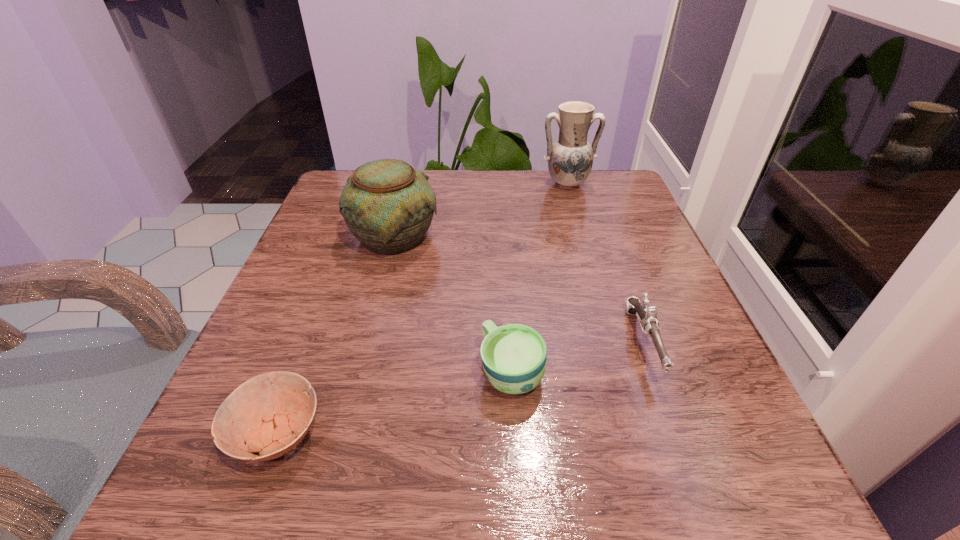
This screenshot has height=540, width=960. Identify the location of free space between the third object from left to right and the gun. (578, 357).

The width and height of the screenshot is (960, 540). Find the location of `free area in between the bowl and the third object from left to right`. free area in between the bowl and the third object from left to right is located at coordinates (395, 403).

Find the location of a particular element. The width and height of the screenshot is (960, 540). free space that is in between the bowl and the taller pottery is located at coordinates (421, 309).

Locate an element on the screen. vacant space in between the tallest object and the cup is located at coordinates (540, 278).

Locate an element on the screen. free space that is in between the fourth nearest object and the cup is located at coordinates (452, 304).

At what (x,y) coordinates should I click in order to perform the action: click on vacant space that's between the farthest object and the cup. Please return your answer as a coordinate pair (x, y). Looking at the image, I should click on (540, 278).

This screenshot has width=960, height=540. What are the coordinates of `unoccupied position between the fourth shortest object and the taller pottery` in the screenshot? It's located at (480, 210).

Where is `object that stands as the closest to the bowl`? object that stands as the closest to the bowl is located at coordinates (514, 356).

Identify the location of object that is the third nearest to the left pottery. Image resolution: width=960 pixels, height=540 pixels. (264, 412).

Where is `free region that satisfies the following two spatial constraints: 1. on the back side of the nearer pottery; 2. on the left side of the bowl`? free region that satisfies the following two spatial constraints: 1. on the back side of the nearer pottery; 2. on the left side of the bowl is located at coordinates (351, 237).